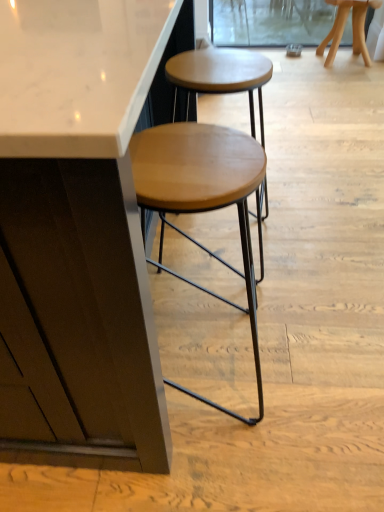
Question: Is wooden seat at center, acting as the second stool starting from the top, not inside wooden stool at upper right, which is counted as the first stool, starting from the top?

Choices:
 (A) yes
 (B) no

Answer: (A)

Question: Considering the relative sizes of wooden seat at center, the second stool in the right-to-left sequence, and wooden stool at upper right, the 1th stool when ordered from right to left, in the image provided, is wooden seat at center, the second stool in the right-to-left sequence, bigger than wooden stool at upper right, the 1th stool when ordered from right to left,?

Choices:
 (A) no
 (B) yes

Answer: (B)

Question: Is wooden seat at center, acting as the second stool starting from the top, at the left side of wooden stool at upper right, positioned as the second stool in bottom-to-top order?

Choices:
 (A) yes
 (B) no

Answer: (A)

Question: Is wooden stool at upper right, positioned as the second stool in bottom-to-top order, completely or partially inside wooden seat at center, acting as the second stool starting from the top?

Choices:
 (A) no
 (B) yes

Answer: (A)

Question: Is wooden seat at center, the 1th stool from the left, closer to camera compared to wooden stool at upper right, which is the second stool from left to right?

Choices:
 (A) yes
 (B) no

Answer: (A)

Question: From the image's perspective, is wooden seat at center, the second stool in the back-to-front sequence, above wooden stool at upper right, the 1th stool when ordered from right to left?

Choices:
 (A) yes
 (B) no

Answer: (B)

Question: Is transparent glass screen door at upper center positioned in front of wooden seat at center, acting as the second stool starting from the top?

Choices:
 (A) yes
 (B) no

Answer: (B)

Question: From the image's perspective, would you say transparent glass screen door at upper center is positioned over wooden seat at center, the second stool in the back-to-front sequence?

Choices:
 (A) no
 (B) yes

Answer: (B)

Question: Does transparent glass screen door at upper center have a smaller size compared to wooden seat at center, the second stool in the right-to-left sequence?

Choices:
 (A) no
 (B) yes

Answer: (B)

Question: From a real-world perspective, is transparent glass screen door at upper center positioned over wooden seat at center, acting as the second stool starting from the top, based on gravity?

Choices:
 (A) no
 (B) yes

Answer: (A)

Question: From the image's perspective, is transparent glass screen door at upper center under wooden seat at center, acting as the second stool starting from the top?

Choices:
 (A) yes
 (B) no

Answer: (B)

Question: Is transparent glass screen door at upper center located outside wooden seat at center, acting as the second stool starting from the top?

Choices:
 (A) yes
 (B) no

Answer: (A)

Question: Could you tell me if wooden stool at upper right, the first stool in the back-to-front sequence, is turned towards transparent glass screen door at upper center?

Choices:
 (A) yes
 (B) no

Answer: (A)